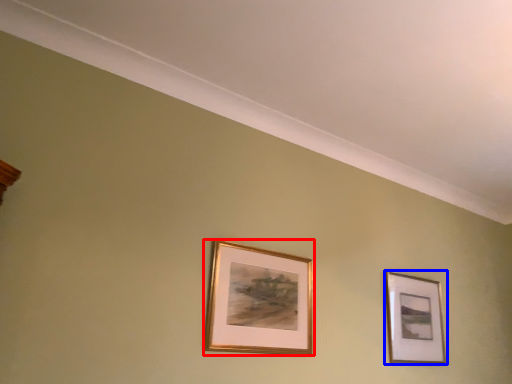
Question: Which object appears closest to the camera in this image, picture frame (highlighted by a red box) or picture frame (highlighted by a blue box)?

Choices:
 (A) picture frame
 (B) picture frame

Answer: (A)